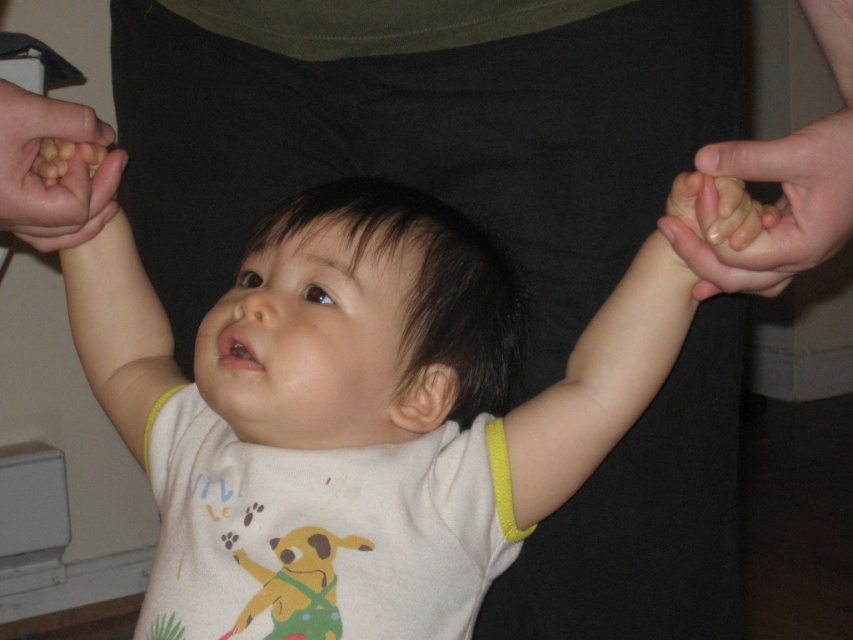
Can you confirm if yellow fabric wristband at right is shorter than smooth skin hand at right?

Incorrect, yellow fabric wristband at right's height does not fall short of smooth skin hand at right's.

Can you confirm if yellow fabric wristband at right is wider than smooth skin hand at right?

Indeed, yellow fabric wristband at right has a greater width compared to smooth skin hand at right.

Identify the location of yellow fabric wristband at right. (601, 384).

Does yellow fabric arm at upper left have a lesser height compared to smooth skin hand at right?

Incorrect, yellow fabric arm at upper left's height does not fall short of smooth skin hand at right's.

Does yellow fabric arm at upper left appear on the right side of smooth skin hand at right?

No, yellow fabric arm at upper left is not to the right of smooth skin hand at right.

Is point (107, 300) less distant than point (703, 196)?

No, (107, 300) is behind (703, 196).

I want to click on yellow fabric arm at upper left, so click(88, 256).

Is point (109, 365) less distant than point (57, 195)?

That is False.

Who is positioned more to the left, yellow fabric arm at upper left or matte skin hand at left?

Result: yellow fabric arm at upper left is more to the left.

Locate an element on the screen. yellow fabric arm at upper left is located at coordinates (88, 256).

You are a GUI agent. You are given a task and a screenshot of the screen. Output one action in this format:
    pyautogui.click(x=<x>, y=<y>)
    Task: Click on the yellow fabric arm at upper left
    Image resolution: width=853 pixels, height=640 pixels.
    Given the screenshot: What is the action you would take?
    pyautogui.click(x=88, y=256)